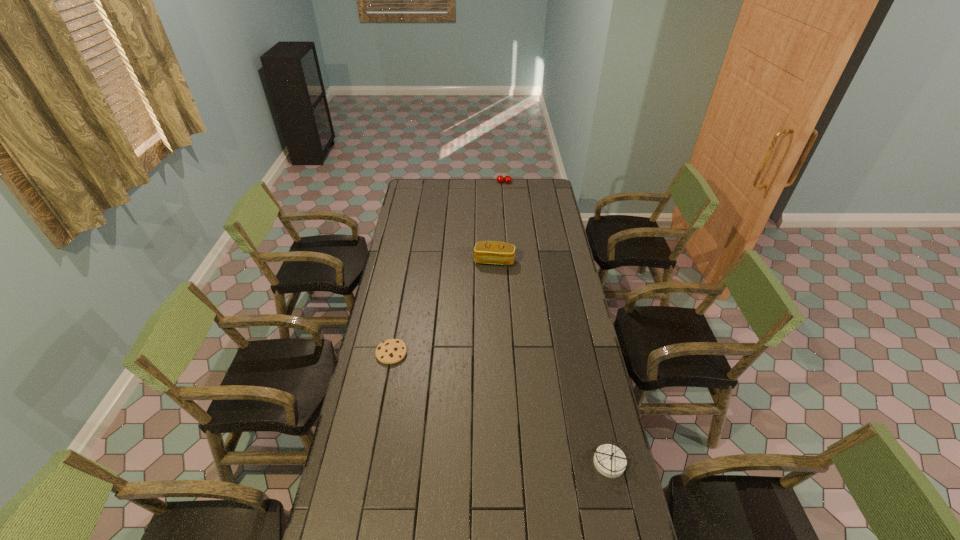
What are the coordinates of `vacant area situated 0.220m with the stems of the farthest object pointing upwards` in the screenshot? It's located at (503, 203).

At what (x,y) coordinates should I click in order to perform the action: click on free space located with the stems of the farthest object pointing upwards. Please return your answer as a coordinate pair (x, y). The width and height of the screenshot is (960, 540). Looking at the image, I should click on (503, 191).

Identify the location of vacant area situated 0.130m with the stems of the farthest object pointing upwards. The height and width of the screenshot is (540, 960). (503, 195).

The image size is (960, 540). In order to click on free spot located on the zipper side of the second farthest object in this screenshot , I will do `click(482, 306)`.

Image resolution: width=960 pixels, height=540 pixels. Find the location of `vacant space located 0.130m on the zipper side of the second farthest object`. vacant space located 0.130m on the zipper side of the second farthest object is located at coordinates (487, 286).

The width and height of the screenshot is (960, 540). I want to click on vacant space located 0.050m on the zipper side of the second farthest object, so click(490, 275).

Locate an element on the screen. The height and width of the screenshot is (540, 960). object present at the far edge is located at coordinates (500, 179).

Identify the location of object that is at the left edge. The height and width of the screenshot is (540, 960). (391, 351).

Identify the location of object located at the right edge. This screenshot has width=960, height=540. (609, 460).

This screenshot has width=960, height=540. Find the location of `vacant space at the far edge of the desktop`. vacant space at the far edge of the desktop is located at coordinates (523, 188).